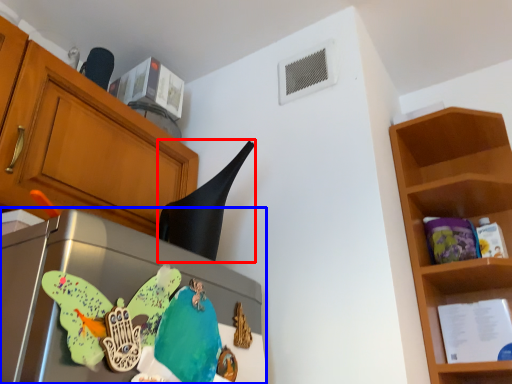
Question: Which object appears closest to the camera in this image, exhaust hood (highlighted by a red box) or appliance (highlighted by a blue box)?

Choices:
 (A) exhaust hood
 (B) appliance

Answer: (B)